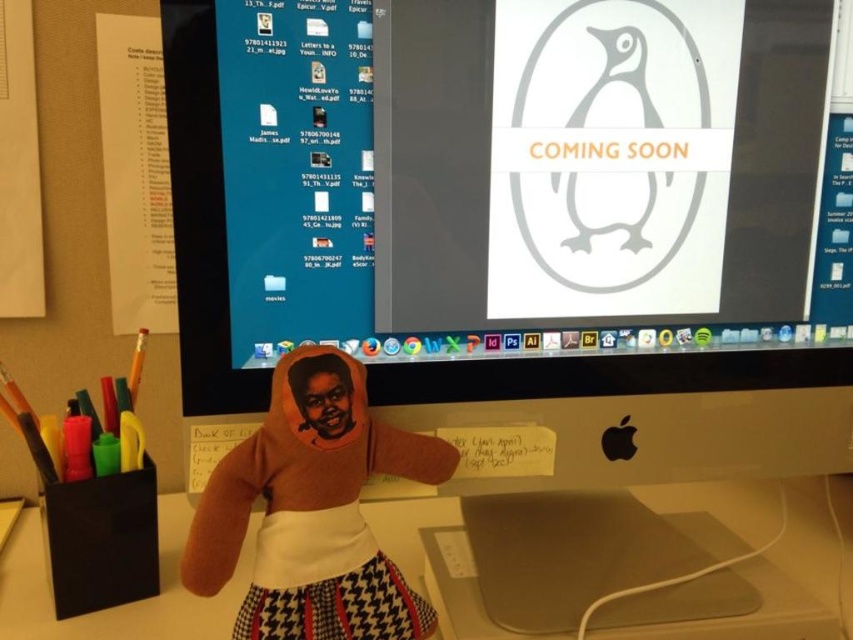
Measure the distance between brown plush doll at center and camera.

brown plush doll at center is 20.66 inches away from camera.

Between point (328, 384) and point (761, 499), which one is positioned behind?

Point (761, 499)

Describe the element at coordinates (312, 509) in the screenshot. I see `brown plush doll at center` at that location.

Find the location of a particular element. brown plush doll at center is located at coordinates (312, 509).